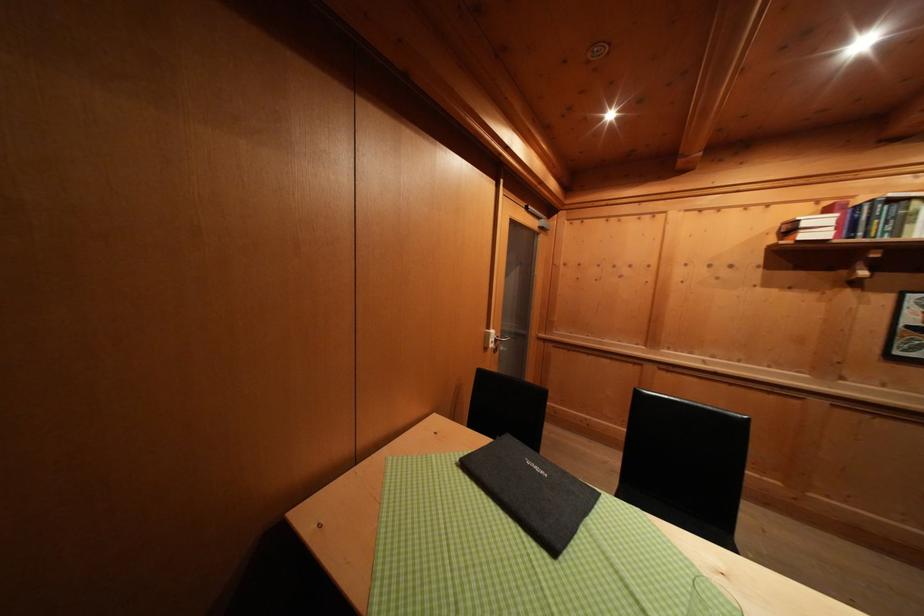
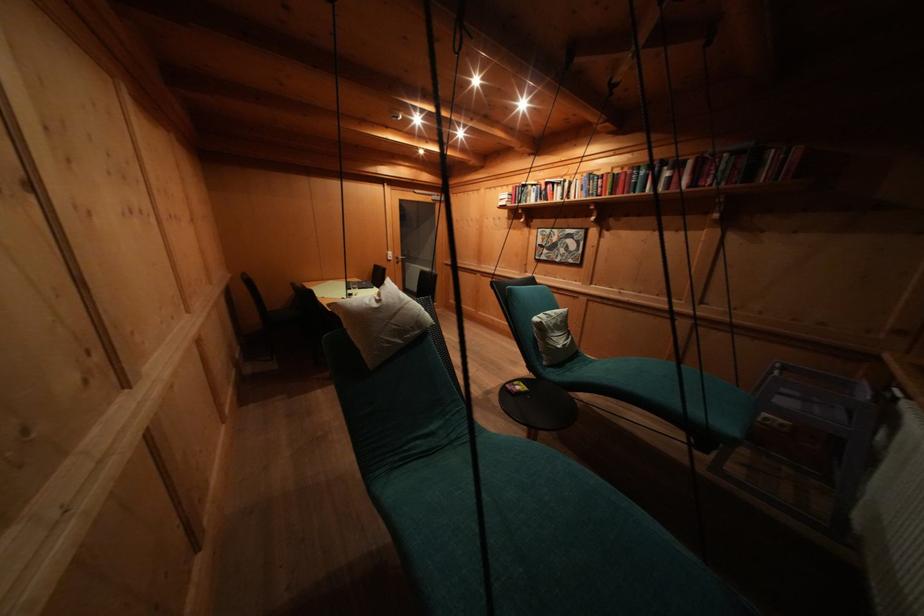
The images are taken continuously from a first-person perspective. In which direction are you moving?

The cameraman moved toward right, backward.